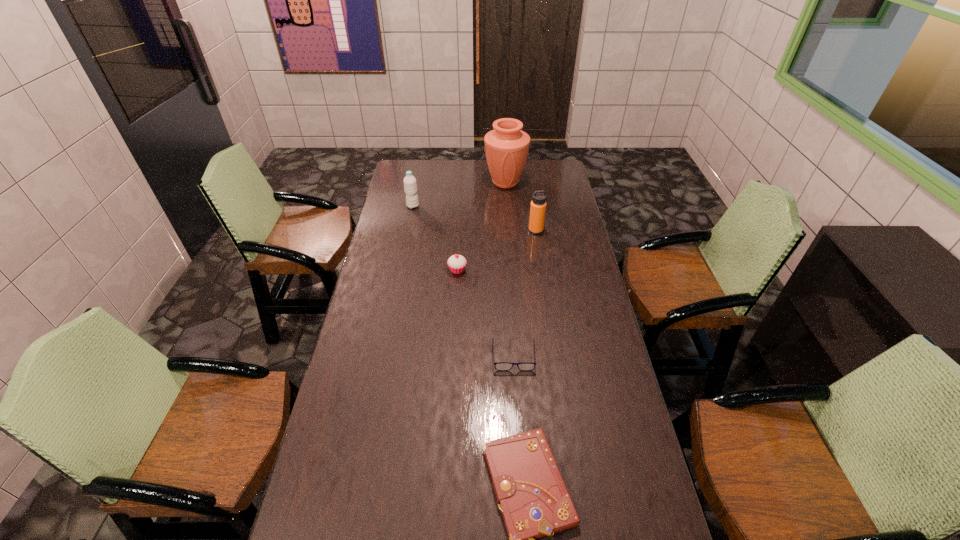
In the image, there is a desktop. Identify the location of vacant space at the far right corner. This screenshot has width=960, height=540. (547, 166).

The width and height of the screenshot is (960, 540). I want to click on vacant area between the fifth nearest object and the cupcake, so click(x=435, y=238).

Find the location of a particular element. This screenshot has width=960, height=540. free spot between the third nearest object and the tallest object is located at coordinates (481, 226).

Where is `free space between the farthest object and the second nearest object`? free space between the farthest object and the second nearest object is located at coordinates (510, 269).

You are a GUI agent. You are given a task and a screenshot of the screen. Output one action in this format:
    pyautogui.click(x=<x>, y=<y>)
    Task: Click on the empty space that is in between the second farthest object and the vase
    This screenshot has height=540, width=960.
    Given the screenshot: What is the action you would take?
    pyautogui.click(x=459, y=194)

Where is `vacant space that's between the third nearest object and the third farthest object`? The height and width of the screenshot is (540, 960). vacant space that's between the third nearest object and the third farthest object is located at coordinates (496, 251).

Locate an element on the screen. This screenshot has width=960, height=540. unoccupied position between the thermos bottle and the spectacles is located at coordinates (525, 293).

Image resolution: width=960 pixels, height=540 pixels. Find the location of `free space between the tallest object and the water bottle`. free space between the tallest object and the water bottle is located at coordinates (459, 194).

Choose which object is the fourth nearest neighbor to the notebook. Please provide its 2D coordinates. Your answer should be formatted as a tuple, i.e. [(x, y)], where the tuple contains the x and y coordinates of a point satisfying the conditions above.

[(410, 186)]

At what (x,y) coordinates should I click in order to perform the action: click on the second closest object to the farthest object. Please return your answer as a coordinate pair (x, y). This screenshot has height=540, width=960. Looking at the image, I should click on (410, 186).